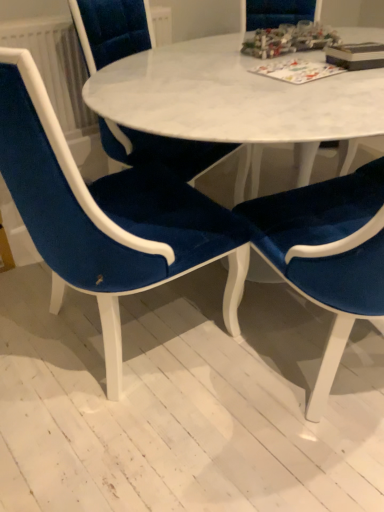
Find the location of `vacant space to the right of matte paper board game at upper center, acting as the first book starting from the left`. vacant space to the right of matte paper board game at upper center, acting as the first book starting from the left is located at coordinates (355, 76).